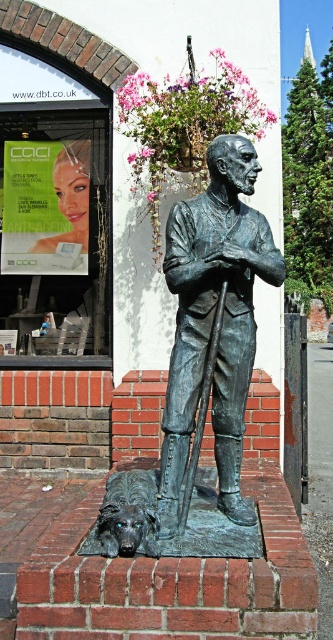
Which is below, bronze statue at center or shiny bronze dog at lower left?

shiny bronze dog at lower left is below.

Can you confirm if bronze statue at center is positioned below shiny bronze dog at lower left?

No, bronze statue at center is not below shiny bronze dog at lower left.

Who is more forward, [251,225] or [123,500]?

Positioned in front is point [123,500].

I want to click on bronze statue at center, so click(x=213, y=320).